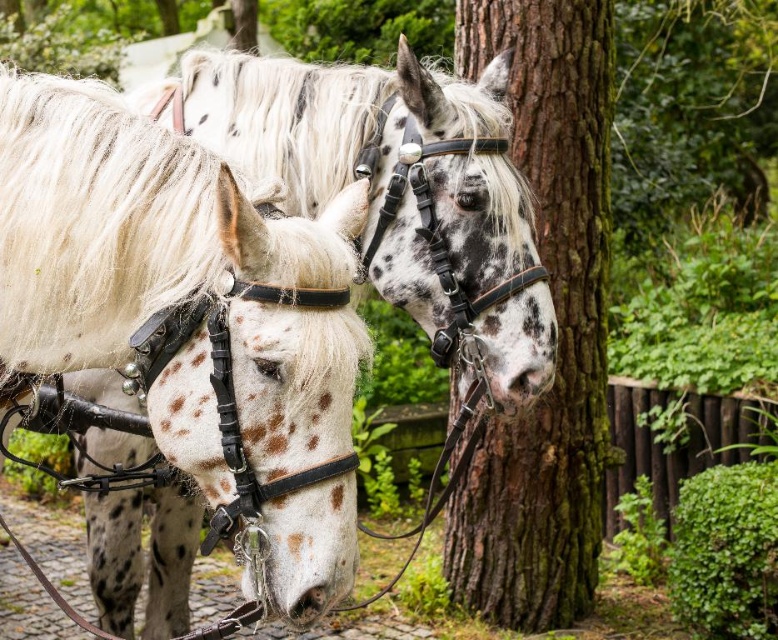
Question: Does spotted white horse at left come in front of speckled leather horse at center?

Choices:
 (A) yes
 (B) no

Answer: (A)

Question: Which of the following is the farthest from the observer?

Choices:
 (A) white textured mane at center
 (B) brown rough bark tree at center

Answer: (B)

Question: Is brown rough bark tree at center closer to camera compared to white textured mane at center?

Choices:
 (A) no
 (B) yes

Answer: (A)

Question: Which point is farther from the camera taking this photo?

Choices:
 (A) (165, 294)
 (B) (408, 202)

Answer: (B)

Question: Which of the following is the farthest from the observer?

Choices:
 (A) (552, 134)
 (B) (493, 269)
 (C) (505, 122)
 (D) (300, 449)

Answer: (A)

Question: Can you confirm if spotted white horse at left is smaller than brown rough bark tree at center?

Choices:
 (A) yes
 (B) no

Answer: (A)